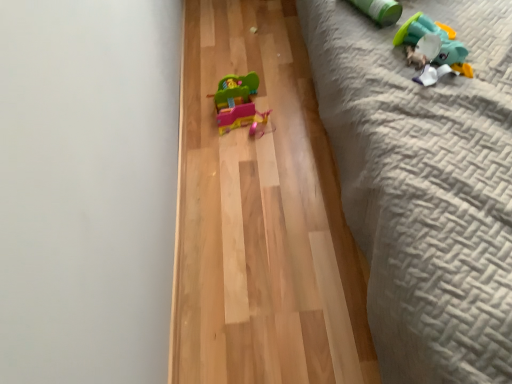
Image resolution: width=512 pixels, height=384 pixels. In order to click on free space above light brown wood flooring at center (from a real-world perspective) in this screenshot , I will do (258, 130).